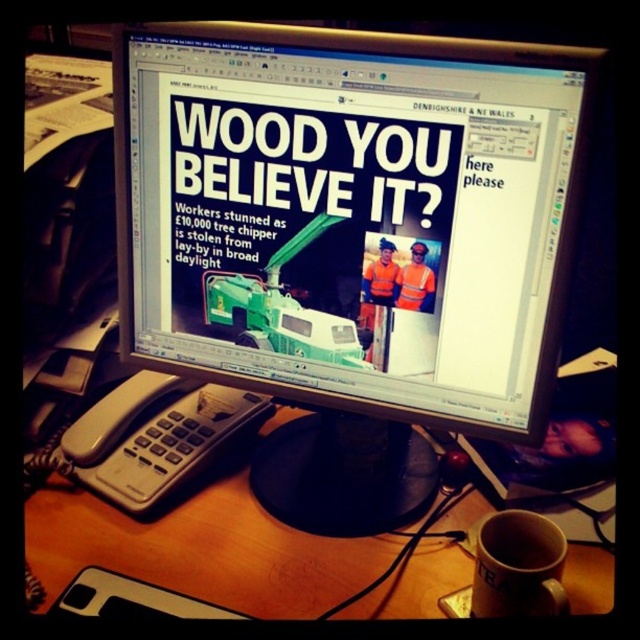
From the picture: Can you confirm if matte plastic monitor at center is taller than reflective orange vest at center?

Yes.

Describe the element at coordinates (348, 211) in the screenshot. The width and height of the screenshot is (640, 640). I see `matte plastic monitor at center` at that location.

Which is in front, point (250, 131) or point (417, 244)?

Point (417, 244)

This screenshot has width=640, height=640. Find the location of `matte plastic monitor at center`. matte plastic monitor at center is located at coordinates (348, 211).